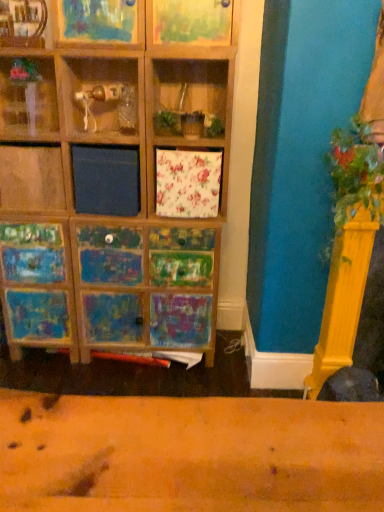
Question: Should I look upward or downward to see wooden shelf at upper left, positioned as the second shelf in left-to-right order?

Choices:
 (A) down
 (B) up

Answer: (B)

Question: In which direction should I rotate to look at wooden frame at upper center, which is the third shelf in left-to-right order?

Choices:
 (A) right
 (B) left

Answer: (B)

Question: Considering the relative positions of wooden shelf at upper left, arranged as the second shelf when viewed from the right, and wooden frame at upper center, arranged as the first shelf when viewed from the right, in the image provided, is wooden shelf at upper left, arranged as the second shelf when viewed from the right, to the right of wooden frame at upper center, arranged as the first shelf when viewed from the right, from the viewer's perspective?

Choices:
 (A) yes
 (B) no

Answer: (B)

Question: Does wooden shelf at upper left, arranged as the second shelf when viewed from the right, lie behind wooden frame at upper center, which is the third shelf in left-to-right order?

Choices:
 (A) no
 (B) yes

Answer: (B)

Question: Is wooden shelf at upper left, arranged as the second shelf when viewed from the right, outside of wooden frame at upper center, which is the third shelf in left-to-right order?

Choices:
 (A) no
 (B) yes

Answer: (B)

Question: Are wooden shelf at upper left, arranged as the second shelf when viewed from the right, and wooden frame at upper center, which is the third shelf in left-to-right order, located far from each other?

Choices:
 (A) yes
 (B) no

Answer: (B)

Question: Does wooden shelf at upper left, arranged as the second shelf when viewed from the right, have a lesser width compared to wooden frame at upper center, arranged as the first shelf when viewed from the right?

Choices:
 (A) yes
 (B) no

Answer: (A)

Question: Is wooden shelf at upper left, arranged as the second shelf when viewed from the right, next to wooden frame at upper center, which is the third shelf in left-to-right order, and touching it?

Choices:
 (A) yes
 (B) no

Answer: (B)

Question: Can you confirm if wooden shelf at upper left, positioned as the second shelf in left-to-right order, is bigger than green leafy plant at right?

Choices:
 (A) no
 (B) yes

Answer: (A)

Question: Is wooden shelf at upper left, arranged as the second shelf when viewed from the right, in front of green leafy plant at right?

Choices:
 (A) yes
 (B) no

Answer: (B)

Question: From the image's perspective, does wooden shelf at upper left, arranged as the second shelf when viewed from the right, appear lower than green leafy plant at right?

Choices:
 (A) no
 (B) yes

Answer: (A)

Question: Is wooden shelf at upper left, positioned as the second shelf in left-to-right order, shorter than green leafy plant at right?

Choices:
 (A) no
 (B) yes

Answer: (B)

Question: Is wooden shelf at upper left, arranged as the second shelf when viewed from the right, wider than green leafy plant at right?

Choices:
 (A) no
 (B) yes

Answer: (A)

Question: Does wooden shelf at upper left, positioned as the second shelf in left-to-right order, contain green leafy plant at right?

Choices:
 (A) no
 (B) yes

Answer: (A)

Question: Is wooden frame at upper center, arranged as the first shelf when viewed from the right, completely or partially inside green leafy plant at right?

Choices:
 (A) yes
 (B) no

Answer: (B)